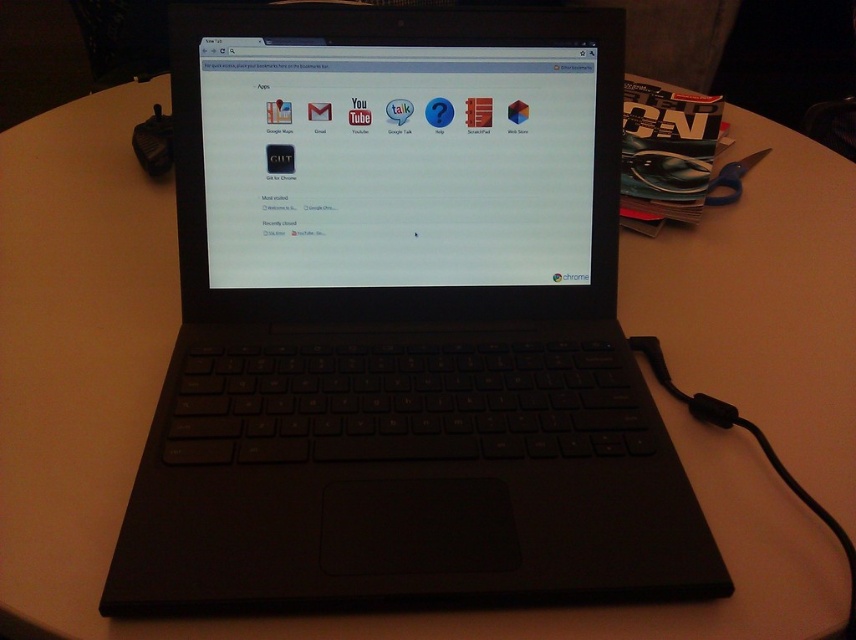
Between black matte laptop at center and black plastic mouse at upper left, which one appears on the right side from the viewer's perspective?

black matte laptop at center

Can you confirm if black matte laptop at center is thinner than black plastic mouse at upper left?

No.

Does point (682, 522) come behind point (152, 115)?

That is False.

The width and height of the screenshot is (856, 640). Identify the location of black matte laptop at center. (401, 324).